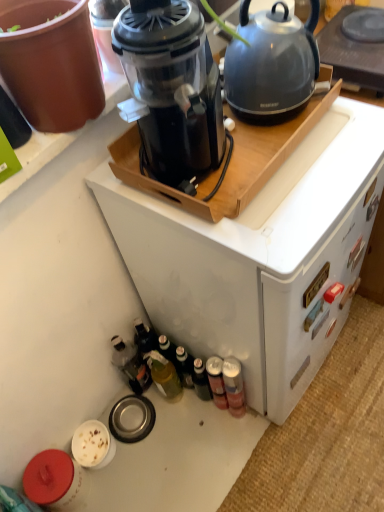
Where is `vacant space in front of metallic silver can at lower right, which is the third bottle from left to right`? vacant space in front of metallic silver can at lower right, which is the third bottle from left to right is located at coordinates (224, 451).